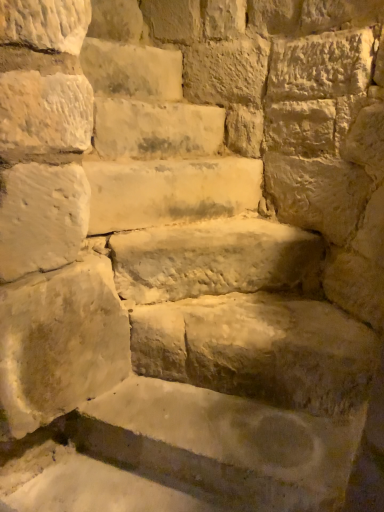
Question: From the image's perspective, would you say smooth stone step at center is shown under smooth stone bench at center, which is counted as the fourth brick, starting from the top?

Choices:
 (A) no
 (B) yes

Answer: (A)

Question: Are smooth stone step at center and smooth stone bench at center, the first brick positioned from the bottom, beside each other?

Choices:
 (A) yes
 (B) no

Answer: (B)

Question: Is the position of smooth stone step at center more distant than that of smooth stone bench at center, the first brick positioned from the bottom?

Choices:
 (A) no
 (B) yes

Answer: (B)

Question: Are smooth stone step at center and smooth stone bench at center, which is counted as the fourth brick, starting from the top, far apart?

Choices:
 (A) no
 (B) yes

Answer: (A)

Question: From a real-world perspective, is smooth stone step at center positioned over smooth stone bench at center, which is counted as the fourth brick, starting from the top, based on gravity?

Choices:
 (A) yes
 (B) no

Answer: (A)

Question: Is smooth stone step at center aimed at smooth stone bench at center, the first brick positioned from the bottom?

Choices:
 (A) yes
 (B) no

Answer: (B)

Question: Could you tell me if smooth stone brick at upper left, which ranks as the 2th brick in top-to-bottom order, is facing white stone at center, which is the second brick from bottom to top?

Choices:
 (A) yes
 (B) no

Answer: (B)

Question: From a real-world perspective, is smooth stone brick at upper left, acting as the 3th brick starting from the bottom, located beneath white stone at center, acting as the third brick starting from the top?

Choices:
 (A) no
 (B) yes

Answer: (A)

Question: Can you confirm if smooth stone brick at upper left, acting as the 3th brick starting from the bottom, is smaller than white stone at center, acting as the third brick starting from the top?

Choices:
 (A) no
 (B) yes

Answer: (A)

Question: Does smooth stone brick at upper left, acting as the 3th brick starting from the bottom, have a lesser width compared to white stone at center, which is the second brick from bottom to top?

Choices:
 (A) no
 (B) yes

Answer: (A)

Question: Is smooth stone brick at upper left, which ranks as the 2th brick in top-to-bottom order, to the left of white stone at center, which is the second brick from bottom to top, from the viewer's perspective?

Choices:
 (A) no
 (B) yes

Answer: (B)

Question: Does smooth stone brick at upper left, acting as the 3th brick starting from the bottom, have a greater height compared to white stone at center, acting as the third brick starting from the top?

Choices:
 (A) no
 (B) yes

Answer: (B)

Question: Is white stone at center, acting as the third brick starting from the top, next to smooth stone brick at upper left, arranged as the first brick when viewed from the top?

Choices:
 (A) yes
 (B) no

Answer: (B)